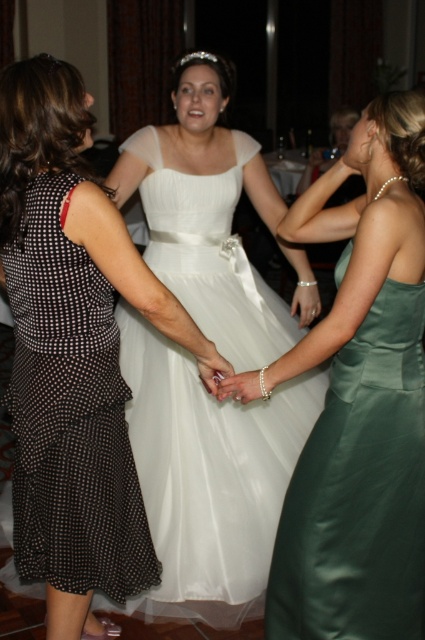
You are a photographer at a wedding reception. You need to capture a photo of the bride in her white satin dress at center and her bridesmaid in her black dotted fabric dress at left. The camera you are using has a maximum focus range of 20 inches. Can you take a photo of both subjects clearly without moving either of them?

The distance between the white satin dress at center and black dotted fabric dress at left is 23.34 inches. Since the camera can only focus up to 20 inches, the subjects are too far apart for the camera to capture both clearly without moving them.

You are a photographer at a wedding reception. You need to position two bridesmaids in such a way that they are equidistant from the bride wearing the white satin dress at center and the white tulle dress at center. Given that the distance between the two dresses is 20.40 inches, what is the minimum distance each bridesmaid should stand from the bride?

The minimum distance each bridesmaid should stand from the bride is 10.20 inches, as this is half of the 20.40 inches between the white satin dress at center and the white tulle dress at center.